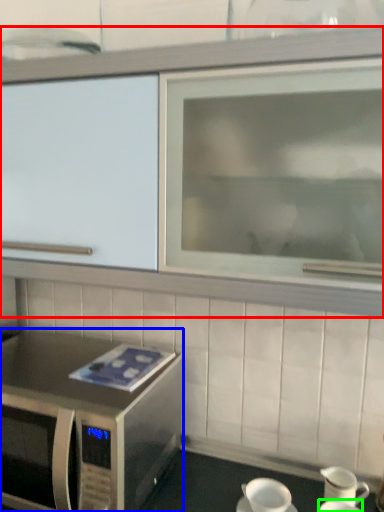
Question: Which object is positioned closest to cabinetry (highlighted by a red box)? Select from microwave oven (highlighted by a blue box) and tableware (highlighted by a green box).

Choices:
 (A) microwave oven
 (B) tableware

Answer: (A)